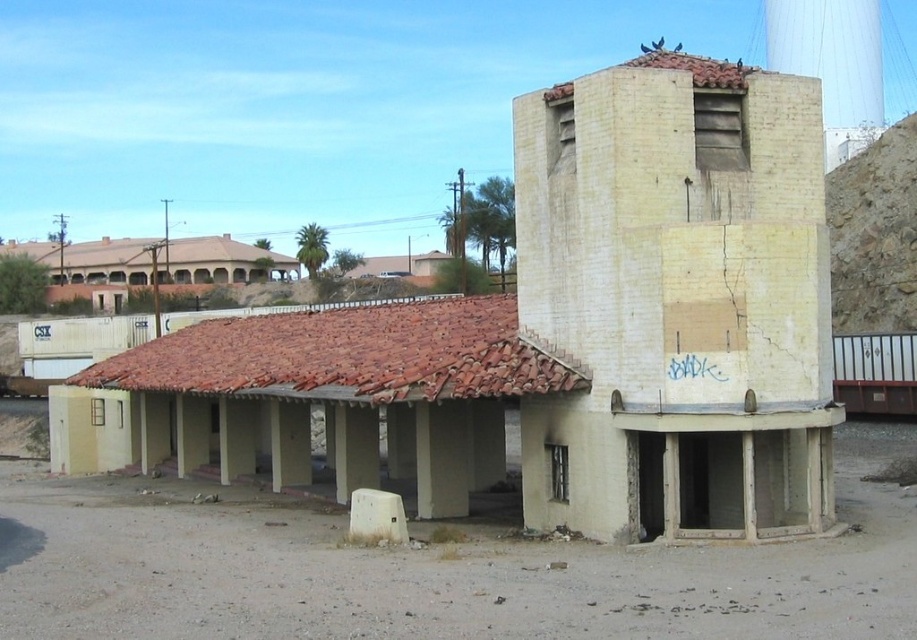
Question: Is yellowish concrete tower at upper right above white concrete water tower at upper center?

Choices:
 (A) no
 (B) yes

Answer: (A)

Question: Which of the following is the farthest from the observer?

Choices:
 (A) white concrete water tower at upper center
 (B) yellowish concrete tower at upper right

Answer: (A)

Question: Is yellowish concrete tower at upper right positioned before white concrete water tower at upper center?

Choices:
 (A) no
 (B) yes

Answer: (B)

Question: Which point is closer to the camera taking this photo?

Choices:
 (A) (705, 317)
 (B) (832, 145)

Answer: (A)

Question: Which point appears farthest from the camera in this image?

Choices:
 (A) (835, 65)
 (B) (728, 419)

Answer: (A)

Question: Does yellowish concrete tower at upper right have a larger size compared to white concrete water tower at upper center?

Choices:
 (A) yes
 (B) no

Answer: (B)